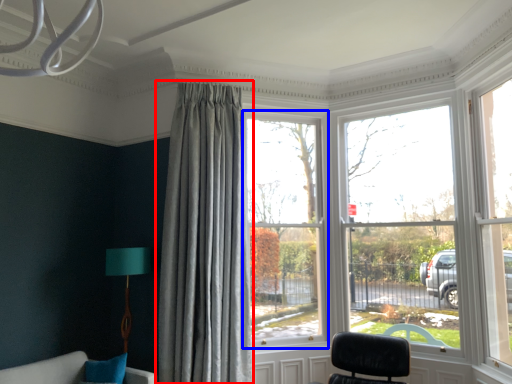
Question: Which object appears farthest to the camera in this image, curtain (highlighted by a red box) or window (highlighted by a blue box)?

Choices:
 (A) curtain
 (B) window

Answer: (B)